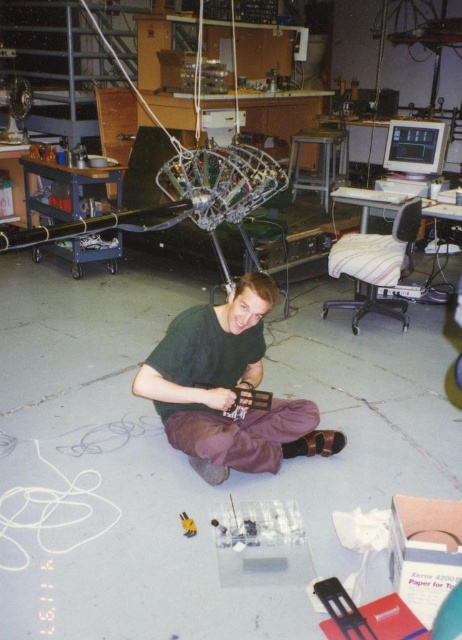
Question: Is green matte shirt at center to the left of yellow plastic screwdriver at lower center from the viewer's perspective?

Choices:
 (A) no
 (B) yes

Answer: (A)

Question: Among these points, which one is nearest to the camera?

Choices:
 (A) (183, 529)
 (B) (260, 362)

Answer: (A)

Question: Among these objects, which one is nearest to the camera?

Choices:
 (A) green matte shirt at center
 (B) yellow plastic screwdriver at lower center

Answer: (B)

Question: Does green matte shirt at center appear on the left side of yellow plastic screwdriver at lower center?

Choices:
 (A) no
 (B) yes

Answer: (A)

Question: Can you confirm if green matte shirt at center is positioned to the left of yellow plastic screwdriver at lower center?

Choices:
 (A) no
 (B) yes

Answer: (A)